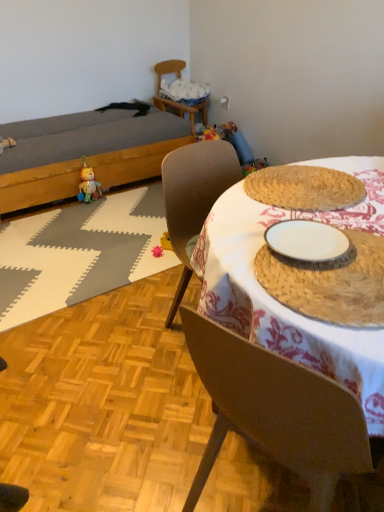
Locate an element on the screen. Image resolution: width=384 pixels, height=512 pixels. free region on the left part of plush yellow bear at lower left, which appears as the first toy when viewed from the back is located at coordinates (68, 208).